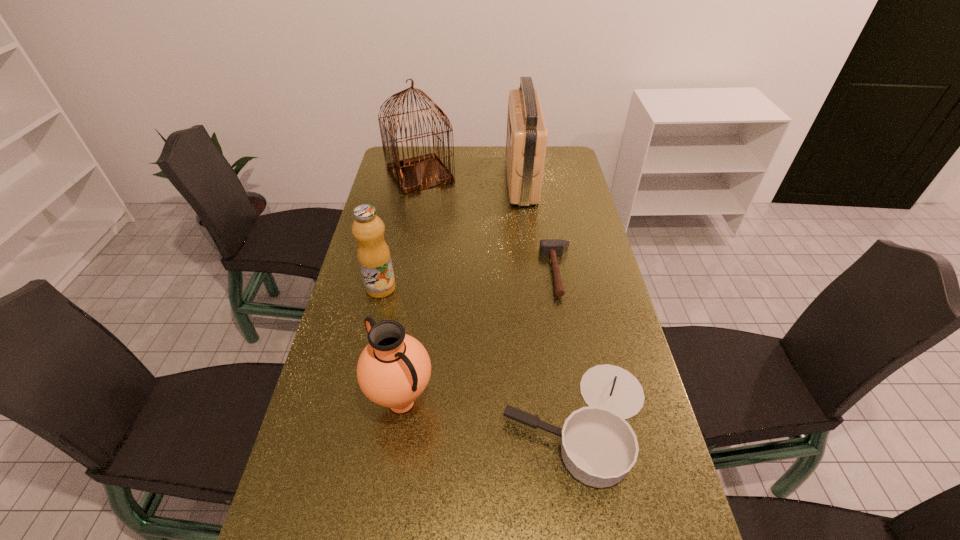
This screenshot has width=960, height=540. In order to click on vacant space situated 0.290m on the front label of the fruit juice in this screenshot , I will do `click(490, 288)`.

Find the location of `vacant space located on the back of the pitcher`. vacant space located on the back of the pitcher is located at coordinates (419, 285).

Where is `free region located on the left of the second shortest object`? free region located on the left of the second shortest object is located at coordinates (415, 422).

The height and width of the screenshot is (540, 960). Find the location of `blank space located 0.300m on the striking surface of the shortest object`. blank space located 0.300m on the striking surface of the shortest object is located at coordinates (449, 272).

Where is `free space located on the striking surface of the shortest object`? free space located on the striking surface of the shortest object is located at coordinates (421, 272).

Locate an element on the screen. The width and height of the screenshot is (960, 540). free space located 0.170m on the striking surface of the shortest object is located at coordinates (490, 272).

Identify the location of birdcage that is at the far edge. The height and width of the screenshot is (540, 960). (413, 174).

Locate an element on the screen. The image size is (960, 540). radio receiver positioned at the far edge is located at coordinates (526, 142).

Identify the location of birdcage at the left edge. (413, 174).

At what (x,y) coordinates should I click in order to perform the action: click on fruit juice at the left edge. Please return your answer as a coordinate pair (x, y). Looking at the image, I should click on (373, 253).